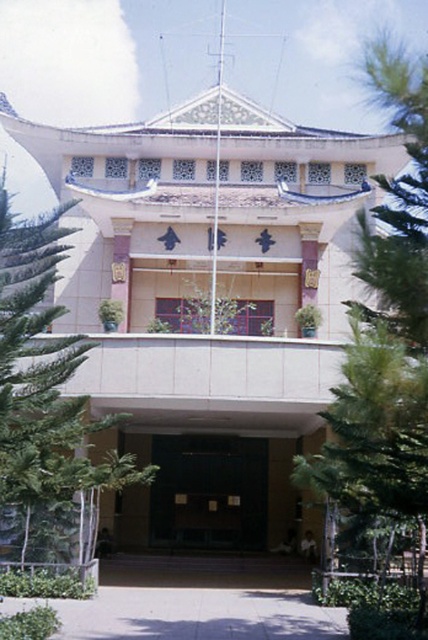
Question: Among these objects, which one is farthest from the camera?

Choices:
 (A) green leafy tree at right
 (B) green leafy tree at left

Answer: (B)

Question: Can you confirm if green leafy tree at right is positioned to the left of black glass door at center?

Choices:
 (A) yes
 (B) no

Answer: (B)

Question: Is green leafy tree at left thinner than black glass door at center?

Choices:
 (A) yes
 (B) no

Answer: (B)

Question: Among these objects, which one is nearest to the camera?

Choices:
 (A) black glass door at center
 (B) green leafy tree at left

Answer: (B)

Question: Based on their relative distances, which object is nearer to the green leafy tree at left?

Choices:
 (A) green leafy tree at right
 (B) black glass door at center

Answer: (A)

Question: Is green leafy tree at right to the right of black glass door at center from the viewer's perspective?

Choices:
 (A) yes
 (B) no

Answer: (A)